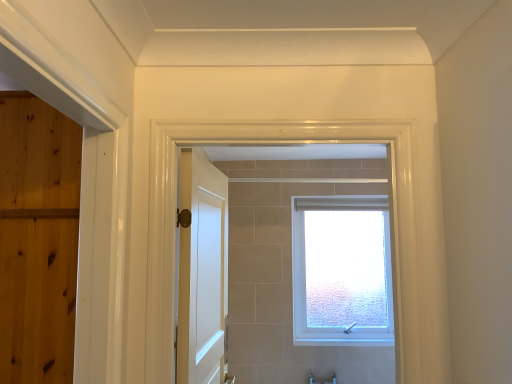
Question: From a real-world perspective, is white frosted glass window at center on top of white glossy door at center?

Choices:
 (A) yes
 (B) no

Answer: (B)

Question: Is white frosted glass window at center facing towards white glossy door at center?

Choices:
 (A) yes
 (B) no

Answer: (A)

Question: Does white frosted glass window at center have a greater height compared to white glossy door at center?

Choices:
 (A) no
 (B) yes

Answer: (B)

Question: Is white frosted glass window at center far from white glossy door at center?

Choices:
 (A) no
 (B) yes

Answer: (B)

Question: Considering the relative sizes of white frosted glass window at center and white glossy door at center in the image provided, is white frosted glass window at center smaller than white glossy door at center?

Choices:
 (A) no
 (B) yes

Answer: (A)

Question: Is white frosted glass window at center oriented away from white glossy door at center?

Choices:
 (A) yes
 (B) no

Answer: (B)

Question: Is white glossy door at center positioned behind white frosted glass window at center?

Choices:
 (A) yes
 (B) no

Answer: (B)

Question: Is white frosted glass window at center completely or partially inside white glossy door at center?

Choices:
 (A) no
 (B) yes

Answer: (A)

Question: Is white glossy door at center far away from white frosted glass window at center?

Choices:
 (A) yes
 (B) no

Answer: (A)

Question: Is white glossy door at center in contact with white frosted glass window at center?

Choices:
 (A) no
 (B) yes

Answer: (A)

Question: Does white glossy door at center have a greater width compared to white frosted glass window at center?

Choices:
 (A) yes
 (B) no

Answer: (B)

Question: Can you confirm if white glossy door at center is positioned to the right of white frosted glass window at center?

Choices:
 (A) no
 (B) yes

Answer: (A)

Question: Considering the positions of white glossy door at center and white frosted glass window at center in the image, is white glossy door at center taller or shorter than white frosted glass window at center?

Choices:
 (A) tall
 (B) short

Answer: (B)